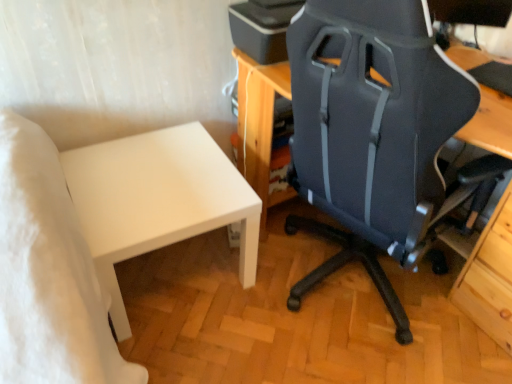
Question: Would you say matte black printer at upper center is a long distance from white matte table at lower left?

Choices:
 (A) no
 (B) yes

Answer: (A)

Question: Does matte black printer at upper center have a larger size compared to white matte table at lower left?

Choices:
 (A) no
 (B) yes

Answer: (A)

Question: Can you confirm if matte black printer at upper center is taller than white matte table at lower left?

Choices:
 (A) yes
 (B) no

Answer: (B)

Question: Considering the relative sizes of matte black printer at upper center and white matte table at lower left in the image provided, is matte black printer at upper center smaller than white matte table at lower left?

Choices:
 (A) yes
 (B) no

Answer: (A)

Question: Is matte black printer at upper center to the left of white matte table at lower left from the viewer's perspective?

Choices:
 (A) no
 (B) yes

Answer: (A)

Question: From the image's perspective, is matte black chair at center located above or below white matte table at lower left?

Choices:
 (A) below
 (B) above

Answer: (B)

Question: Choose the correct answer: Is matte black chair at center inside white matte table at lower left or outside it?

Choices:
 (A) outside
 (B) inside

Answer: (A)

Question: Is matte black chair at center bigger or smaller than white matte table at lower left?

Choices:
 (A) big
 (B) small

Answer: (A)

Question: Does point (409, 195) appear closer or farther from the camera than point (245, 205)?

Choices:
 (A) farther
 (B) closer

Answer: (B)

Question: Is point (284, 34) positioned closer to the camera than point (109, 192)?

Choices:
 (A) farther
 (B) closer

Answer: (B)

Question: In the image, is matte black printer at upper center positioned in front of or behind white matte table at lower left?

Choices:
 (A) front
 (B) behind

Answer: (B)

Question: Do you think matte black printer at upper center is within white matte table at lower left, or outside of it?

Choices:
 (A) inside
 (B) outside

Answer: (B)

Question: Considering the positions of matte black printer at upper center and white matte table at lower left in the image, is matte black printer at upper center taller or shorter than white matte table at lower left?

Choices:
 (A) tall
 (B) short

Answer: (B)

Question: In the image, is white matte table at lower left positioned in front of or behind matte black printer at upper center?

Choices:
 (A) front
 (B) behind

Answer: (A)

Question: Considering the positions of point (154, 145) and point (268, 39), is point (154, 145) closer or farther from the camera than point (268, 39)?

Choices:
 (A) farther
 (B) closer

Answer: (A)